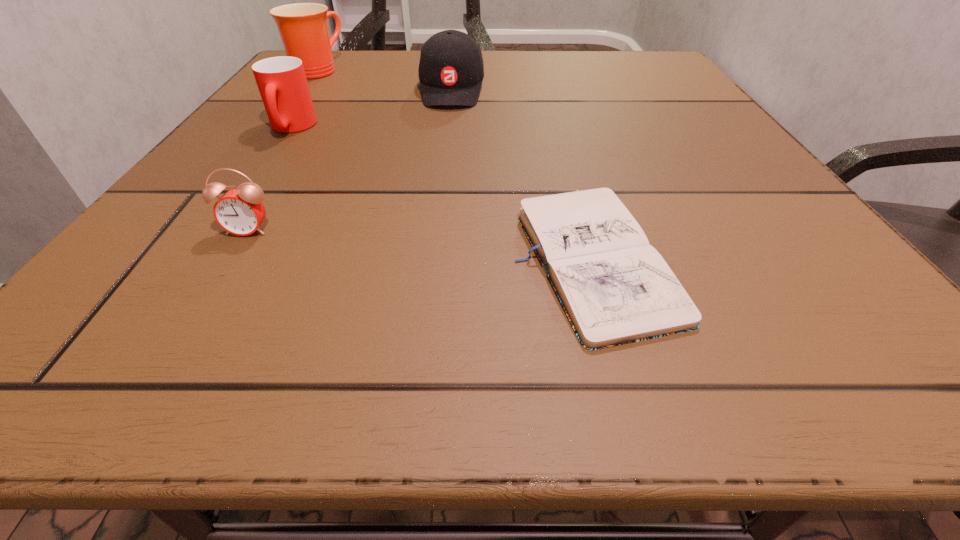
You are a GUI agent. You are given a task and a screenshot of the screen. Output one action in this format:
    pyautogui.click(x=<x>, y=<y>)
    Task: Click on the vacant area located 0.270m on the side of the shorter cup with the handle
    
    Given the screenshot: What is the action you would take?
    pyautogui.click(x=210, y=248)

This screenshot has width=960, height=540. Identify the location of free space located 0.090m on the clock face of the second shortest object. (212, 289).

Identify the location of free space located on the back of the rightmost object. The height and width of the screenshot is (540, 960). (556, 127).

I want to click on cup positioned at the far edge, so click(303, 28).

Where is `baseball cap situated at the far edge`? The image size is (960, 540). baseball cap situated at the far edge is located at coordinates (451, 70).

Find the location of a particular element. This screenshot has height=540, width=960. object located at the near edge is located at coordinates (615, 288).

Find the location of a particular element. The image size is (960, 540). alarm clock located in the left edge section of the desktop is located at coordinates (240, 211).

Image resolution: width=960 pixels, height=540 pixels. In order to click on object present at the far left corner in this screenshot , I will do `click(303, 28)`.

Locate an element on the screen. Image resolution: width=960 pixels, height=540 pixels. vacant space at the far edge of the desktop is located at coordinates (537, 84).

Where is `vacant region at the left edge of the desktop`? The height and width of the screenshot is (540, 960). vacant region at the left edge of the desktop is located at coordinates (325, 122).